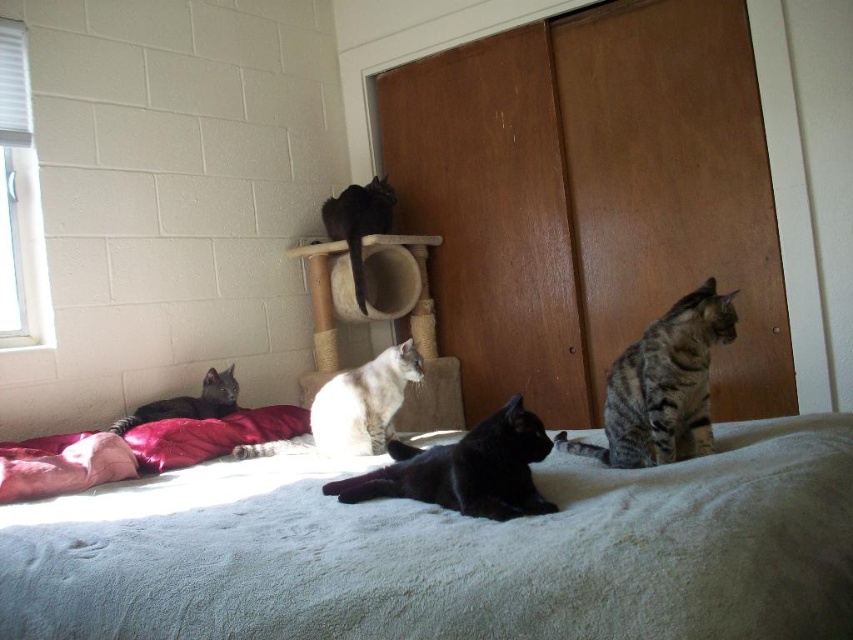
Question: Which of the following is the closest to the observer?

Choices:
 (A) tabby fur cat at right
 (B) velvet red pillow at lower left
 (C) shiny black cat at lower left

Answer: (A)

Question: Can you confirm if white soft bed at center is smaller than shiny black cat at lower left?

Choices:
 (A) yes
 (B) no

Answer: (B)

Question: Which of the following is the farthest from the observer?

Choices:
 (A) velvet red pillow at lower left
 (B) shiny black cat at center
 (C) white soft bed at center
 (D) shiny black cat at lower left

Answer: (D)

Question: Which point appears closest to the camera in this image?

Choices:
 (A) [x=119, y=433]
 (B) [x=65, y=624]

Answer: (B)

Question: In this image, where is white fur cat at center located relative to silky black cat at center?

Choices:
 (A) below
 (B) above

Answer: (A)

Question: Can you confirm if shiny black cat at center is smaller than velvet red pillow at lower left?

Choices:
 (A) yes
 (B) no

Answer: (B)